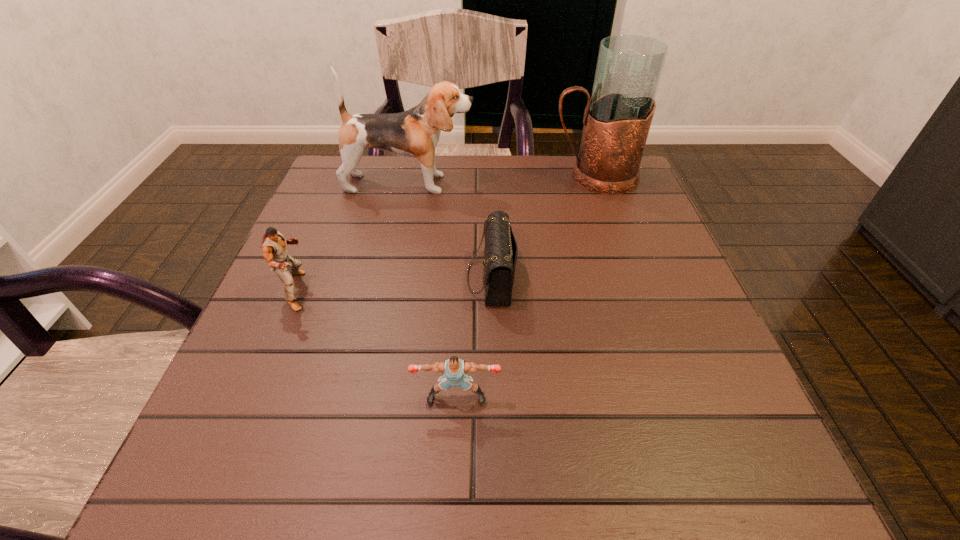
At what (x,y) coordinates should I click in order to perform the action: click on the rightmost object. Please return your answer as a coordinate pair (x, y). Image resolution: width=960 pixels, height=540 pixels. Looking at the image, I should click on (617, 119).

Image resolution: width=960 pixels, height=540 pixels. I want to click on puppy, so click(x=415, y=133).

Find the location of a particular element. The image size is (960, 540). the farther puncher is located at coordinates (274, 245).

The height and width of the screenshot is (540, 960). Find the location of `the third shortest object`. the third shortest object is located at coordinates (274, 245).

Find the location of a particular element. clutch bag is located at coordinates (500, 253).

Where is `the shorter puncher`? This screenshot has width=960, height=540. the shorter puncher is located at coordinates (454, 370).

What are the coordinates of `the nearest object` in the screenshot? It's located at (454, 370).

You are a GUI agent. You are given a task and a screenshot of the screen. Output one action in this format:
    pyautogui.click(x=<x>, y=<y>)
    Task: Click on the free space located with the handle on the side of the rightmost object
    Image resolution: width=960 pixels, height=540 pixels.
    Given the screenshot: What is the action you would take?
    pyautogui.click(x=489, y=177)

What are the coordinates of `free point located with the handle on the side of the rightmost object` in the screenshot? It's located at (415, 177).

The image size is (960, 540). Identify the location of free location located 0.390m with the handle on the side of the rightmost object. (399, 177).